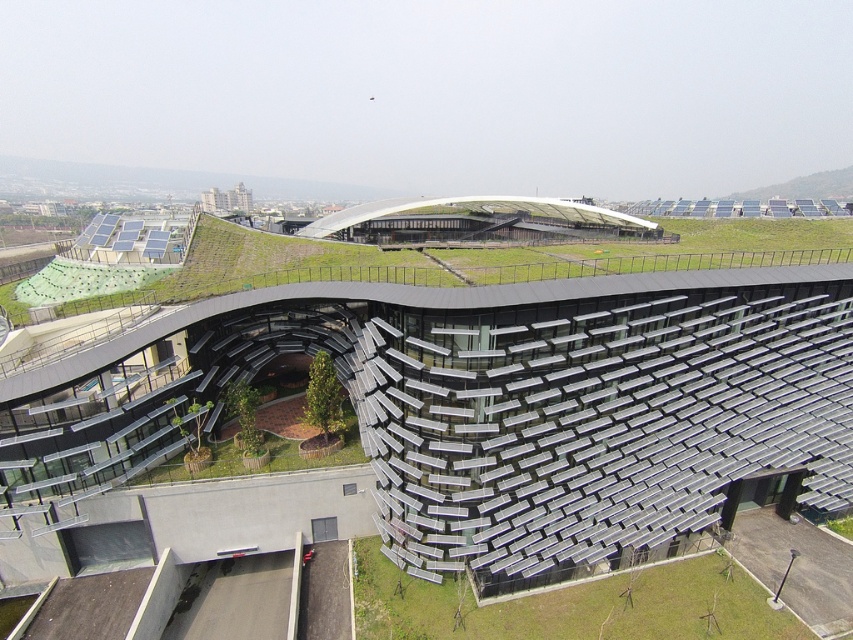
Question: Which of the following is the closest to the observer?

Choices:
 (A) green grass at lower right
 (B) metallic solar panels at center

Answer: (B)

Question: Which of these objects is positioned farthest from the green grass at upper center?

Choices:
 (A) metallic solar panels at center
 (B) green grass at lower right

Answer: (B)

Question: Observing the image, what is the correct spatial positioning of green grass at upper center in reference to green grass at lower right?

Choices:
 (A) below
 (B) above

Answer: (B)

Question: Which point is farther from the camera taking this photo?

Choices:
 (A) (265, 244)
 (B) (630, 634)

Answer: (A)

Question: Is metallic solar panels at center thinner than green grass at upper center?

Choices:
 (A) yes
 (B) no

Answer: (A)

Question: Is metallic solar panels at center closer to the viewer compared to green grass at lower right?

Choices:
 (A) no
 (B) yes

Answer: (B)